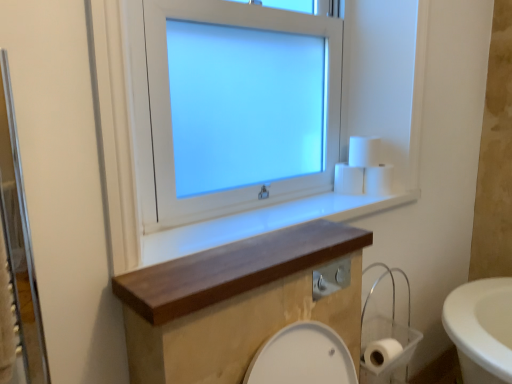
Locate an element on the screen. This screenshot has width=512, height=384. vacant area on top of wooden at upper center (from a real-world perspective) is located at coordinates (250, 223).